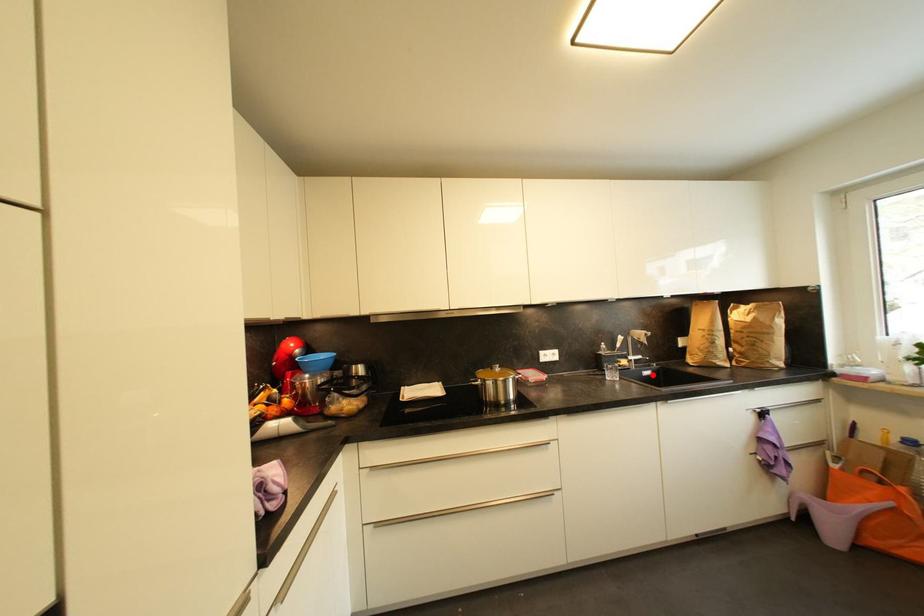
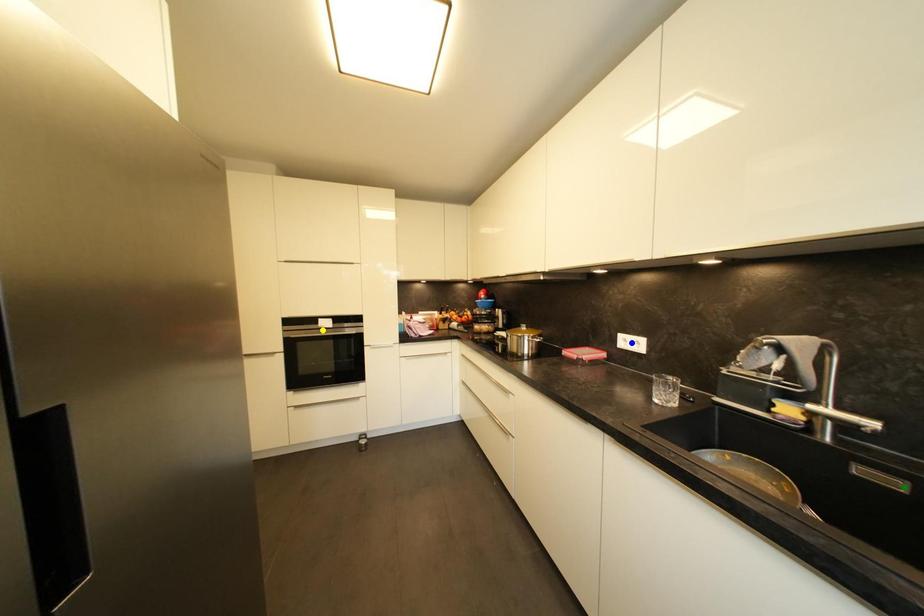
Question: I am providing you with two images of the same scene from different viewpoints. A red point is marked on the first image. You are given multiple points on the second image. Which point in image 2 represents the same 3d spot as the red point in image 1?

Choices:
 (A) blue point
 (B) green point
 (C) yellow point

Answer: (B)